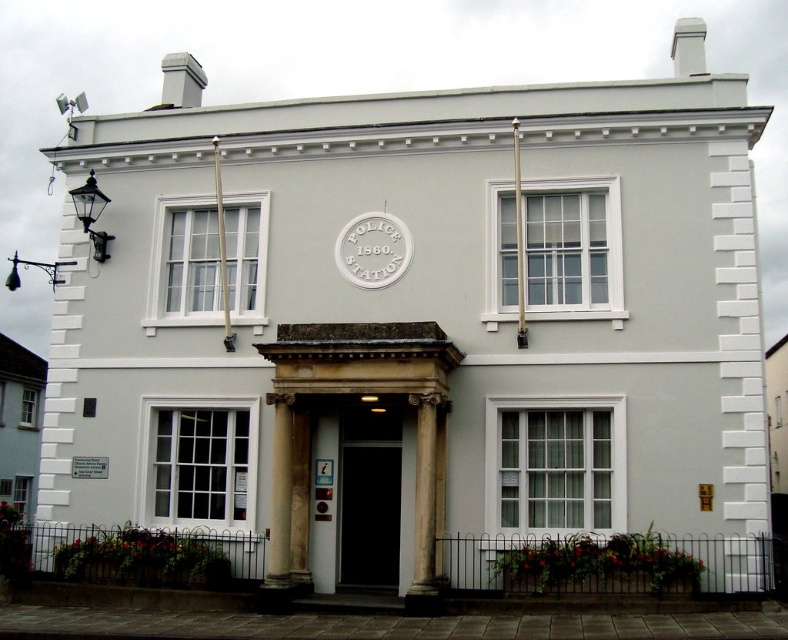
From the picture: You are standing in front of the two story building. There is a point marked at coordinate (x=424, y=506). What object is located at that point?

The point at coordinate (x=424, y=506) indicates the location of the white marble column at center.

You are a visitor approaching the entrance of the police station. You see the black glass door at center and the white marble pillar at center. Which object is closer to you as you approach the entrance?

The black glass door at center is closer to you than the white marble pillar at center as you approach the entrance.

You are a visitor approaching the entrance of the police station. You notice the black glass door at center and the white marble pillar at center. Which object is located directly above the other?

The white marble pillar at center is directly above the black glass door at center because the black glass door at center is positioned under the white marble pillar at center.